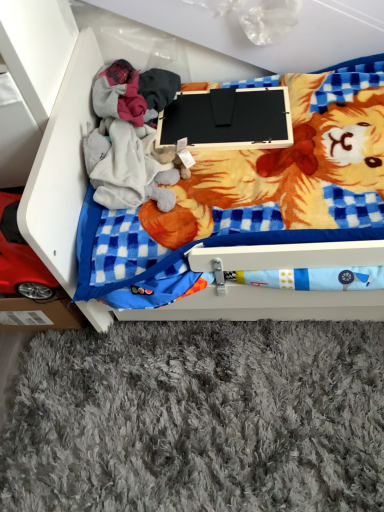
Question: Is the depth of black matte laptop at center greater than that of red plastic toy car at lower left?

Choices:
 (A) yes
 (B) no

Answer: (A)

Question: From the image's perspective, would you say black matte laptop at center is positioned over red plastic toy car at lower left?

Choices:
 (A) no
 (B) yes

Answer: (B)

Question: From a real-world perspective, is black matte laptop at center over red plastic toy car at lower left?

Choices:
 (A) no
 (B) yes

Answer: (B)

Question: Is black matte laptop at center oriented towards red plastic toy car at lower left?

Choices:
 (A) no
 (B) yes

Answer: (A)

Question: Are black matte laptop at center and red plastic toy car at lower left making contact?

Choices:
 (A) no
 (B) yes

Answer: (A)

Question: Relative to black matte laptop at center, is wooden drawer at center in front or behind?

Choices:
 (A) behind
 (B) front

Answer: (B)

Question: Would you say wooden drawer at center is inside or outside black matte laptop at center?

Choices:
 (A) outside
 (B) inside

Answer: (A)

Question: Is point (87, 108) positioned closer to the camera than point (205, 95)?

Choices:
 (A) closer
 (B) farther

Answer: (A)

Question: From the image's perspective, relative to black matte laptop at center, is wooden drawer at center above or below?

Choices:
 (A) above
 (B) below

Answer: (B)

Question: Considering the relative positions of black matte laptop at center and wooden drawer at center in the image provided, is black matte laptop at center to the left or to the right of wooden drawer at center?

Choices:
 (A) left
 (B) right

Answer: (A)

Question: Is black matte laptop at center spatially inside wooden drawer at center, or outside of it?

Choices:
 (A) inside
 (B) outside

Answer: (A)

Question: From a real-world perspective, is black matte laptop at center positioned above or below wooden drawer at center?

Choices:
 (A) below
 (B) above

Answer: (B)

Question: Is point (258, 134) closer or farther from the camera than point (46, 245)?

Choices:
 (A) farther
 (B) closer

Answer: (A)

Question: Choose the correct answer: Is red plastic toy car at lower left inside wooden drawer at center or outside it?

Choices:
 (A) outside
 (B) inside

Answer: (A)

Question: Considering the positions of point (11, 225) and point (221, 307), is point (11, 225) closer or farther from the camera than point (221, 307)?

Choices:
 (A) farther
 (B) closer

Answer: (B)